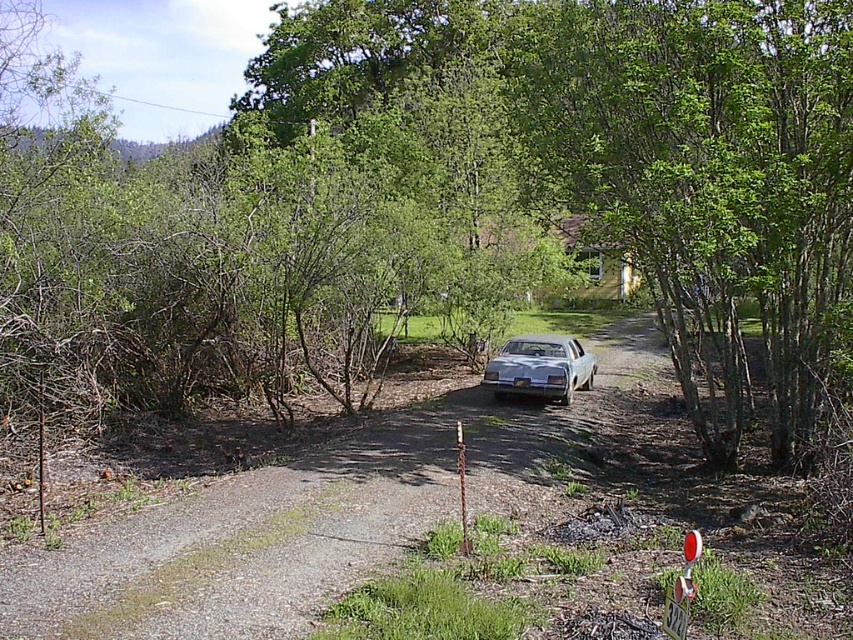
You are standing at the point labeled as point (x=454, y=195) in the image. What is the closest object to you in the scene?

The closest object to you at point (x=454, y=195) is the green leafy tree at center because the point is located on it.

You are a delivery driver approaching the house via the gravel driveway. You need to park your truck, which is the same size as the silver metallic car at center, in a spot that won fit the green leafy tree at center. Is there enough space between them?

The green leafy tree at center is larger in size than the silver metallic car at center. Since your truck is the same size as the car, there might not be enough space to park between them without hitting the tree.

You are driving a truck that is 20 feet long and want to park it on the gravel driveway in the scene. The driveway is flanked by green leafy tree at center and silver metallic car at center. Considering the space between these two objects, can your truck fit between them without touching either?

The distance between the green leafy tree at center and the silver metallic car at center is 29.76 feet. Since your truck is 20 feet long, there is enough space for it to fit between them without touching either object.